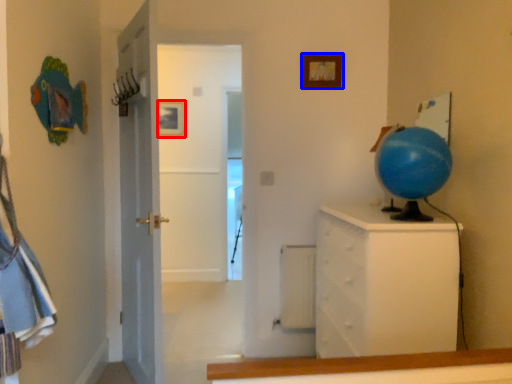
Question: Which object is further to the camera taking this photo, picture frame (highlighted by a red box) or picture frame (highlighted by a blue box)?

Choices:
 (A) picture frame
 (B) picture frame

Answer: (A)